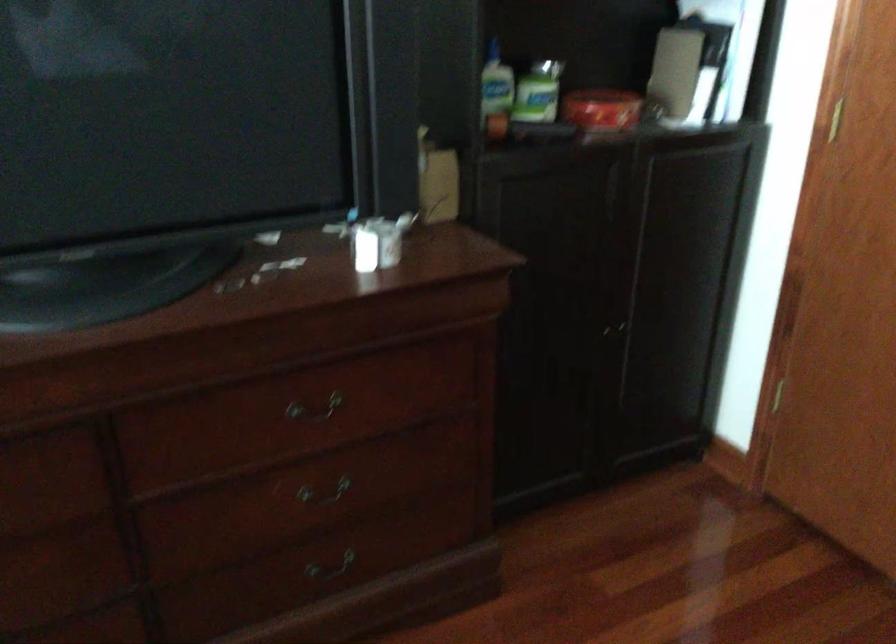
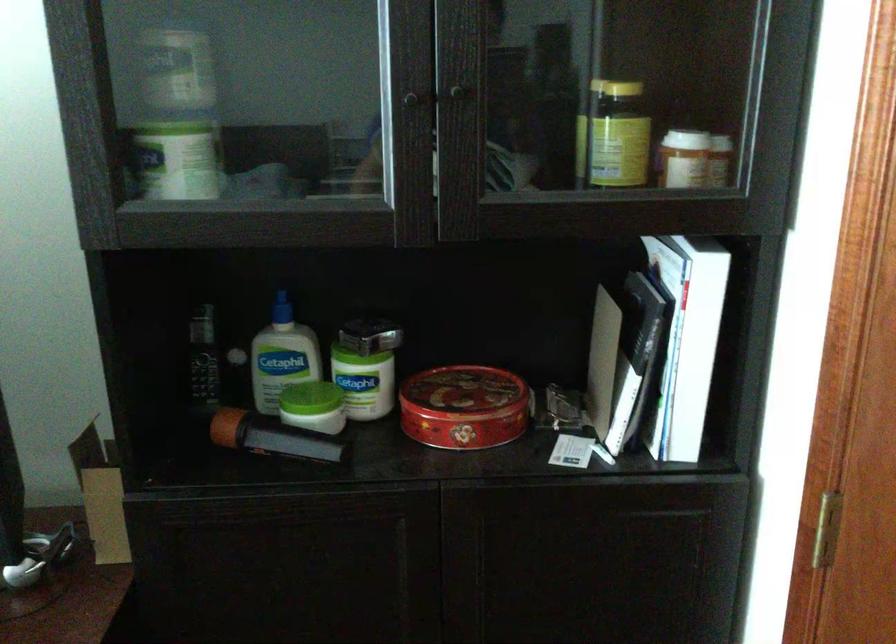
Locate, in the second image, the point that corresponds to (x=521, y=122) in the first image.

(268, 436)